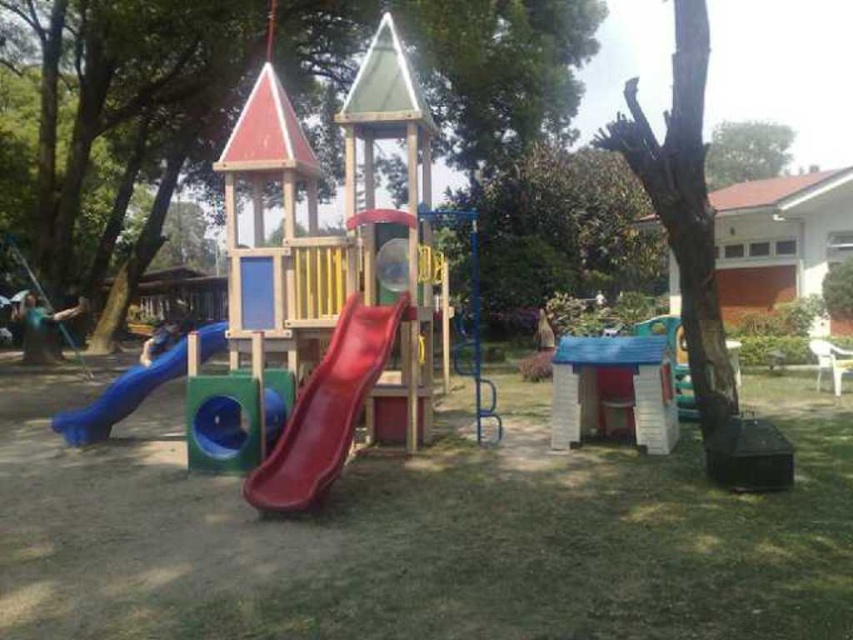
Question: Which of the following is the farthest from the observer?

Choices:
 (A) (180, 333)
 (B) (535, 298)

Answer: (A)

Question: Where is rubber smooth slide at center located in relation to metallic silver swing at left in the image?

Choices:
 (A) left
 (B) right

Answer: (B)

Question: Among these points, which one is nearest to the camera?

Choices:
 (A) (160, 337)
 (B) (770, 148)

Answer: (A)

Question: Is brown wood tree at center further to camera compared to rubber smooth slide at center?

Choices:
 (A) no
 (B) yes

Answer: (B)

Question: Does rubber smooth slide at center have a smaller size compared to metallic silver swing at left?

Choices:
 (A) no
 (B) yes

Answer: (B)

Question: Based on their relative distances, which object is farther from the brown rough bark tree at center?

Choices:
 (A) blue rubber slide at center
 (B) rubber smooth slide at left
 (C) green leafy tree at upper center
 (D) metallic silver swing at left

Answer: (C)